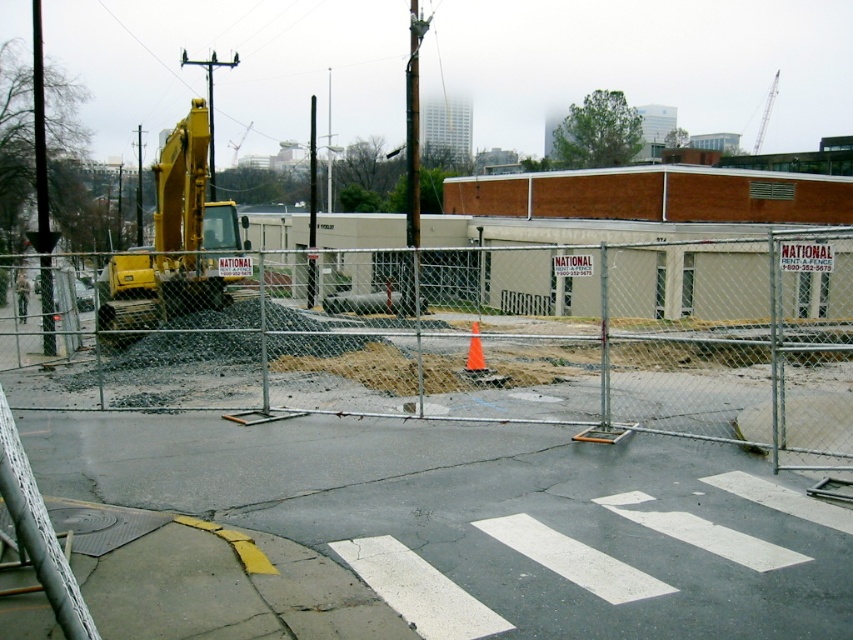
You are standing at the entrance of the construction site and see the orange matte traffic cone at center. If you walk straight ahead, will you reach the cone before the fence?

The orange matte traffic cone at center is located at point (x=474, y=353) in 2D coordinates, which is within the fenced area. Since you are at the entrance, walking straight ahead would first encounter the fence before reaching the cone.

You are a construction worker standing at the edge of the construction site. You notice an orange matte traffic cone at center and a green camouflage uniform at center. Which object is positioned lower from your viewpoint?

The orange matte traffic cone at center is below green camouflage uniform at center, so the orange matte traffic cone at center is positioned lower from your viewpoint.